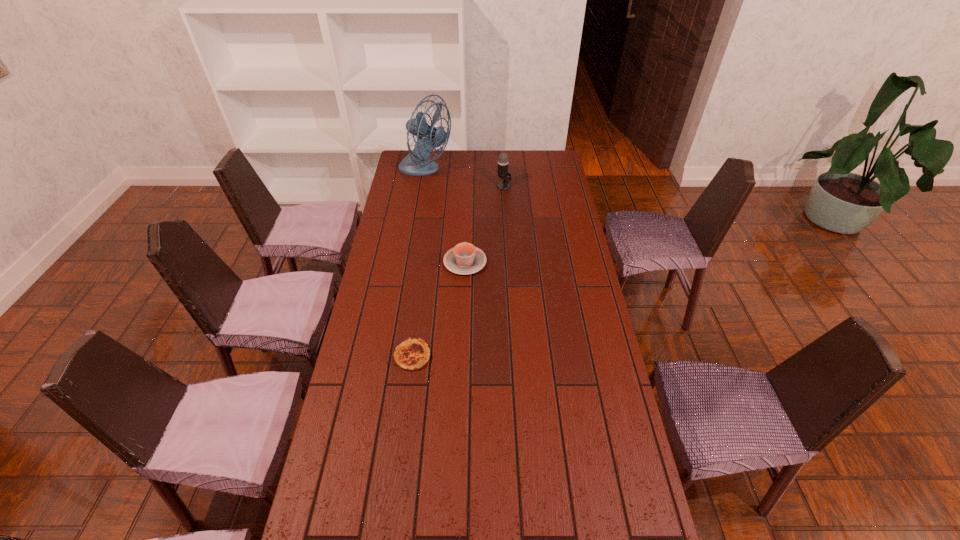
Identify the location of vacant space in between the quiche and the third farthest object. (439, 309).

You are a GUI agent. You are given a task and a screenshot of the screen. Output one action in this format:
    pyautogui.click(x=<x>, y=<y>)
    Task: Click on the free spot between the second nearest object and the microphone
    The image size is (960, 540).
    Given the screenshot: What is the action you would take?
    pyautogui.click(x=484, y=224)

What are the coordinates of `free space between the tallest object and the second tallest object` in the screenshot? It's located at (465, 179).

Image resolution: width=960 pixels, height=540 pixels. Identify the location of blank region between the fan and the microphone. (465, 179).

Locate which object ranks third in proximity to the rightmost object. Please provide its 2D coordinates. Your answer should be formatted as a tuple, i.e. [(x, y)], where the tuple contains the x and y coordinates of a point satisfying the conditions above.

[(411, 355)]

Identify which object is located as the nearest to the rightmost object. Please provide its 2D coordinates. Your answer should be formatted as a tuple, i.e. [(x, y)], where the tuple contains the x and y coordinates of a point satisfying the conditions above.

[(429, 137)]

The image size is (960, 540). Identify the location of vacant area in the image that satisfies the following two spatial constraints: 1. on the handle side of the second shortest object; 2. in front of the tallest object to blow air. (468, 172).

Where is `vacant space that satisfies the following two spatial constraints: 1. on the back side of the rightmost object; 2. in front of the fan to blow air`? vacant space that satisfies the following two spatial constraints: 1. on the back side of the rightmost object; 2. in front of the fan to blow air is located at coordinates (503, 172).

Where is `free space that satisfies the following two spatial constraints: 1. in front of the rightmost object to blow air; 2. on the left side of the tallest object`? Image resolution: width=960 pixels, height=540 pixels. free space that satisfies the following two spatial constraints: 1. in front of the rightmost object to blow air; 2. on the left side of the tallest object is located at coordinates (422, 186).

Where is `free space that satisfies the following two spatial constraints: 1. in front of the fan to blow air; 2. on the back side of the second tallest object`? The height and width of the screenshot is (540, 960). free space that satisfies the following two spatial constraints: 1. in front of the fan to blow air; 2. on the back side of the second tallest object is located at coordinates (422, 186).